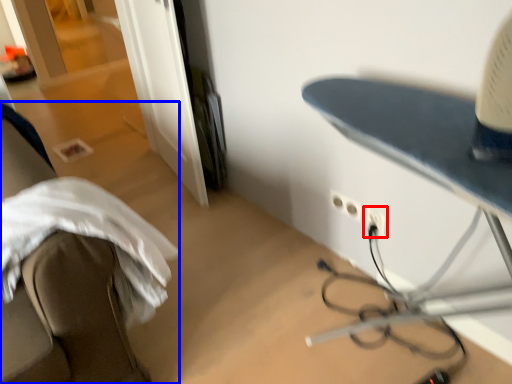
Question: Which point is closer to the camera, electric outlet (highlighted by a red box) or furniture (highlighted by a blue box)?

Choices:
 (A) electric outlet
 (B) furniture

Answer: (B)